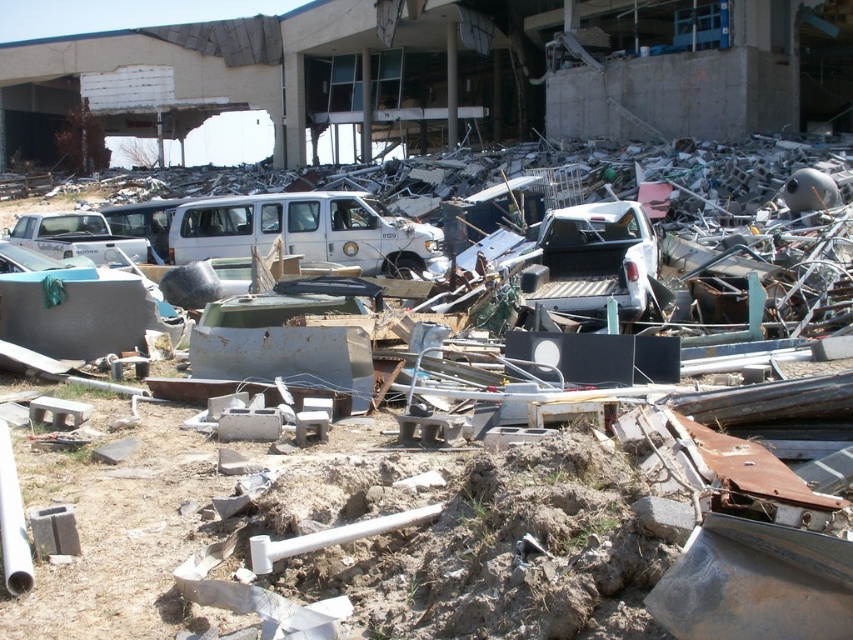
You are a rescue worker trying to navigate through the debris field. You see two reference points marked as point (596, 301) and point (126, 243). Which point is closer to you as you approach the debris field?

Point (596, 301) is in front of point (126, 243), so it is closer to you as you approach the debris field.